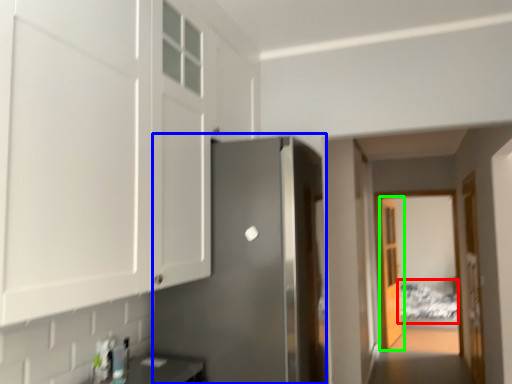
Question: Considering the real-world distances, which object is closest to bed (highlighted by a red box)? door (highlighted by a blue box) or door (highlighted by a green box).

Choices:
 (A) door
 (B) door

Answer: (B)